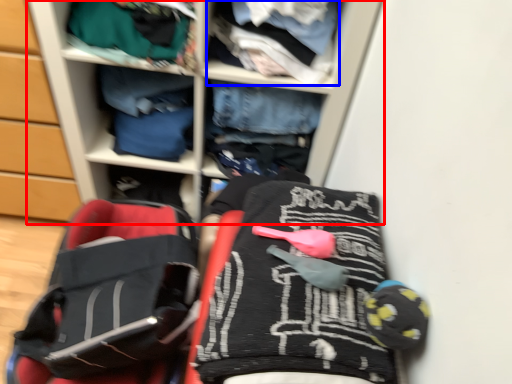
Question: Among these objects, which one is farthest to the camera, shelf (highlighted by a red box) or clothing (highlighted by a blue box)?

Choices:
 (A) shelf
 (B) clothing

Answer: (B)